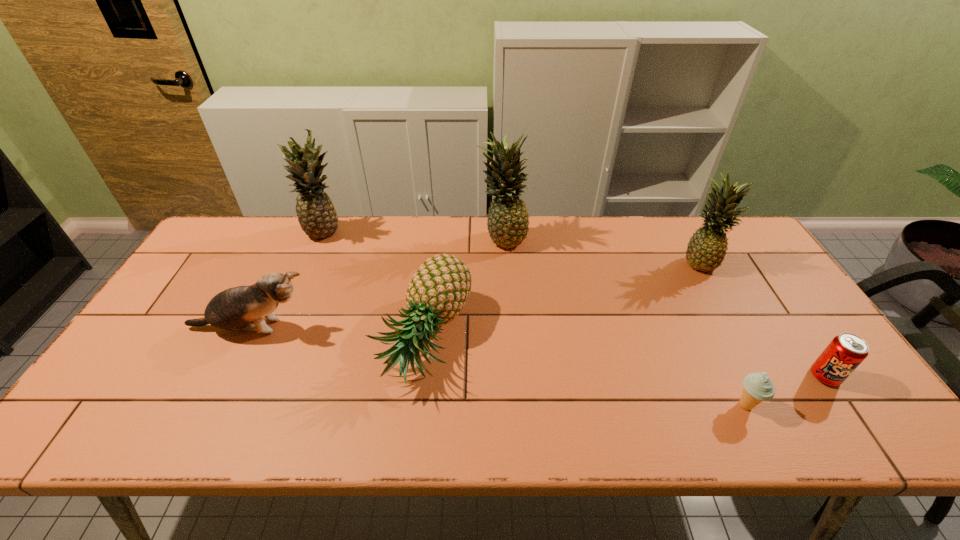
The height and width of the screenshot is (540, 960). I want to click on free space between the cat and the icecream, so click(x=498, y=366).

Locate an element on the screen. The height and width of the screenshot is (540, 960). free space between the rightmost pineapple and the second pineapple from right to left is located at coordinates (602, 249).

Where is `free point between the soda can and the fifth object from right to left`? The height and width of the screenshot is (540, 960). free point between the soda can and the fifth object from right to left is located at coordinates (625, 356).

What are the coordinates of `object that stands as the third closest to the icecream` in the screenshot? It's located at (436, 294).

What are the coordinates of `the fourth closest object to the leftmost pineapple` in the screenshot? It's located at (706, 250).

Locate an element on the screen. This screenshot has width=960, height=540. pineapple object that ranks as the second closest to the second pineapple from right to left is located at coordinates (316, 214).

Where is `pineapple that can be found as the closest to the cat`? pineapple that can be found as the closest to the cat is located at coordinates (436, 294).

You are a GUI agent. You are given a task and a screenshot of the screen. Output one action in this format:
    pyautogui.click(x=<x>, y=<y>)
    Task: Click on the free spot that satisfies the following two spatial constraints: 1. on the front side of the rightmost object; 2. on the left side of the third tallest pineapple
    This screenshot has width=960, height=540.
    Given the screenshot: What is the action you would take?
    pyautogui.click(x=764, y=376)

Where is `free space in the image that satisfies the following two spatial constraints: 1. at the face of the cat; 2. on the right side of the rightmost object`? free space in the image that satisfies the following two spatial constraints: 1. at the face of the cat; 2. on the right side of the rightmost object is located at coordinates (228, 376).

This screenshot has width=960, height=540. I want to click on blank area in the image that satisfies the following two spatial constraints: 1. on the front side of the second pineapple from right to left; 2. on the right side of the rightmost object, so tap(511, 376).